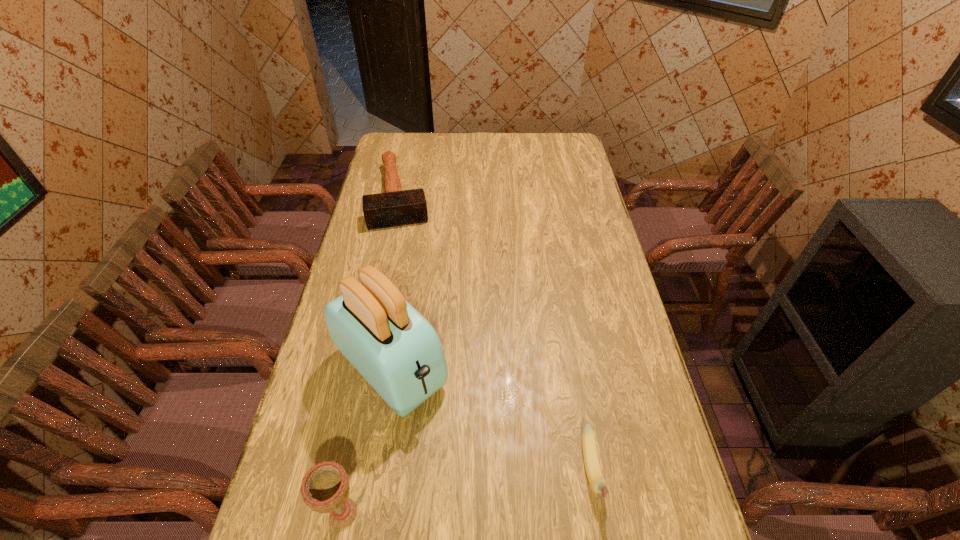
The width and height of the screenshot is (960, 540). In order to click on free space located 0.310m on the striking face of the mallet in this screenshot , I will do `click(410, 289)`.

Locate an element on the screen. The image size is (960, 540). blank area located 0.080m on the striking face of the mallet is located at coordinates (403, 244).

What are the coordinates of `chalice located at the near edge` in the screenshot? It's located at (325, 488).

Where is `banana that is at the near edge`? banana that is at the near edge is located at coordinates (597, 482).

The image size is (960, 540). I want to click on chalice that is at the left edge, so click(325, 488).

Locate an element on the screen. toaster situated at the left edge is located at coordinates (397, 351).

Image resolution: width=960 pixels, height=540 pixels. In order to click on mallet located at the left edge in this screenshot , I will do `click(395, 207)`.

Find the location of a particular element. The height and width of the screenshot is (540, 960). object present at the near left corner is located at coordinates (325, 488).

Locate an element on the screen. The width and height of the screenshot is (960, 540). vacant space at the far edge of the desktop is located at coordinates (484, 145).

Locate an element on the screen. Image resolution: width=960 pixels, height=540 pixels. free location at the left edge is located at coordinates (x=406, y=181).